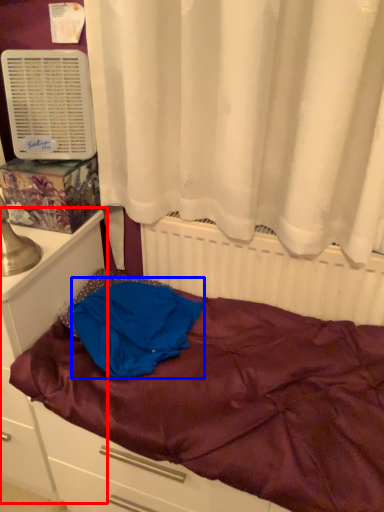
Question: Which point is closer to the camera, file cabinet (highlighted by a red box) or blanket (highlighted by a blue box)?

Choices:
 (A) file cabinet
 (B) blanket

Answer: (A)